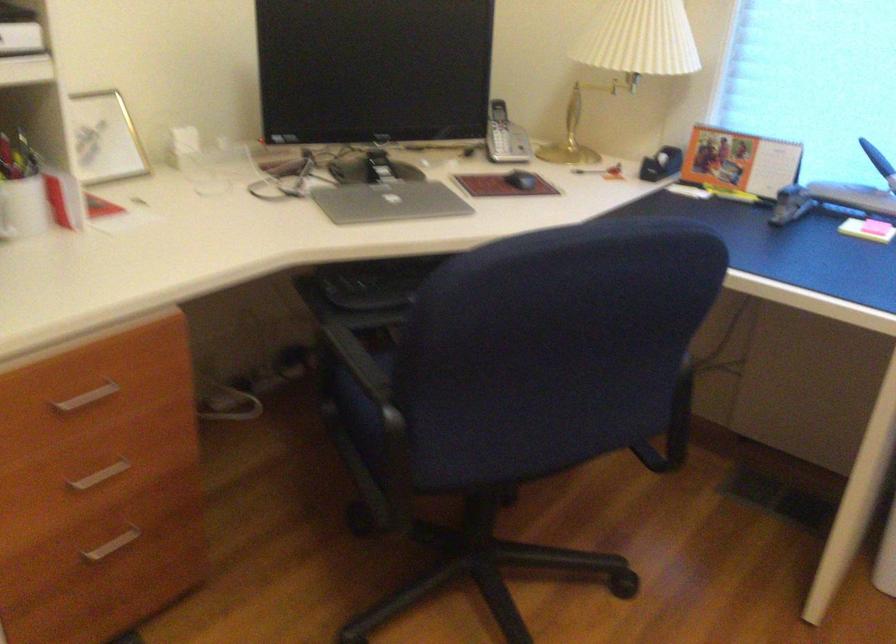
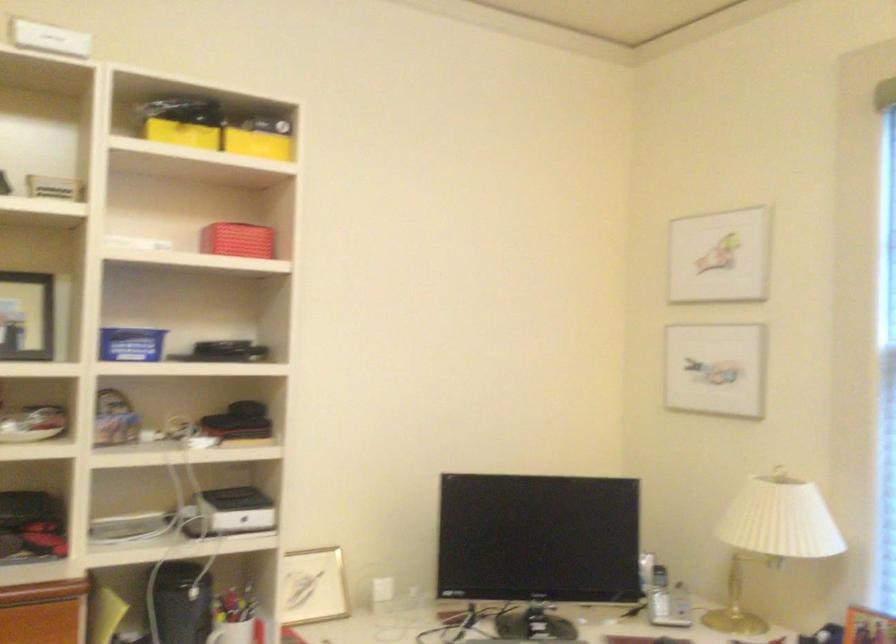
Where in the second image is the point corresponding to pixel 503 131 from the first image?

(659, 594)